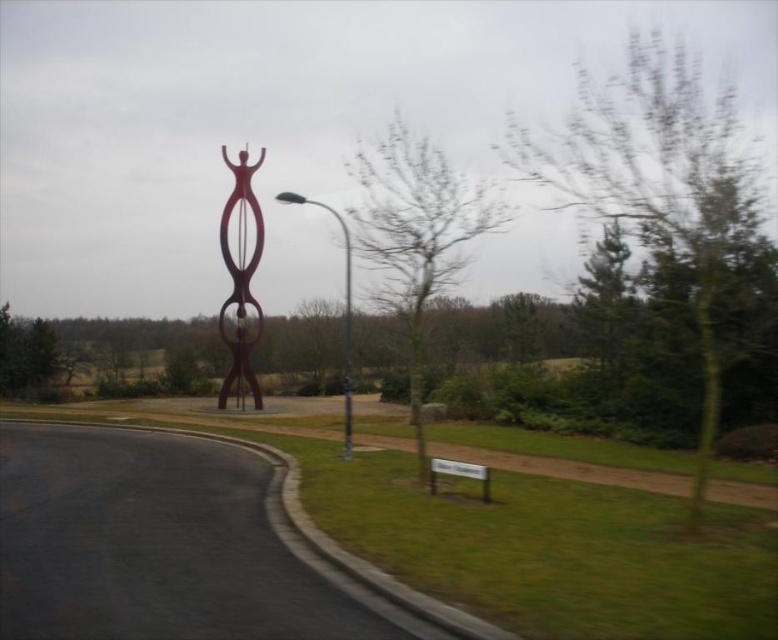
Describe the element at coordinates (657, 179) in the screenshot. I see `green leafy tree at upper right` at that location.

Can you confirm if green leafy tree at upper right is wider than glossy metal sculpture at center?

Indeed, green leafy tree at upper right has a greater width compared to glossy metal sculpture at center.

Is point (671, 168) closer to camera compared to point (239, 236)?

Yes, point (671, 168) is in front of point (239, 236).

Locate an element on the screen. The height and width of the screenshot is (640, 778). green leafy tree at upper right is located at coordinates pyautogui.click(x=657, y=179).

In the scene shown: Can you confirm if green leafy tree at upper right is positioned to the left of metallic pole at center?

In fact, green leafy tree at upper right is to the right of metallic pole at center.

Image resolution: width=778 pixels, height=640 pixels. What do you see at coordinates (657, 179) in the screenshot?
I see `green leafy tree at upper right` at bounding box center [657, 179].

Where is `green leafy tree at upper right`? green leafy tree at upper right is located at coordinates (657, 179).

You are a GUI agent. You are given a task and a screenshot of the screen. Output one action in this format:
    pyautogui.click(x=<x>, y=<y>)
    Task: Click on the green leafy tree at upper right
    Image resolution: width=778 pixels, height=640 pixels.
    Given the screenshot: What is the action you would take?
    pyautogui.click(x=657, y=179)

Is green leafy tree at center below glossy metal sculpture at center?

No.

Between green leafy tree at center and glossy metal sculpture at center, which one appears on the right side from the viewer's perspective?

green leafy tree at center is more to the right.

Find the location of a particular element. green leafy tree at center is located at coordinates (415, 236).